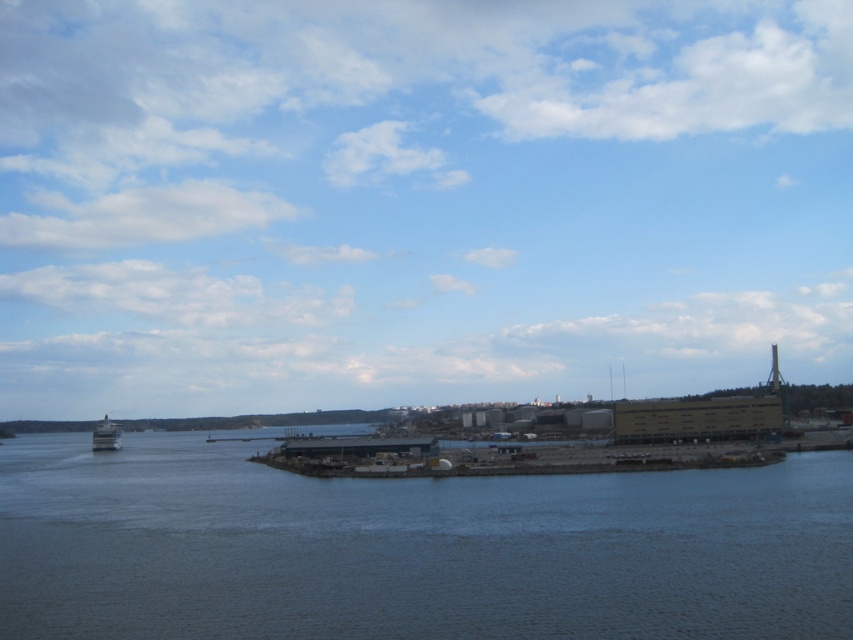
In the scene shown: You are standing on the shore looking at the dark blue water at lower center and the metallic gray boat at left. Which object is nearer to you?

The dark blue water at lower center is closer to the viewer than the metallic gray boat at left.

You are standing on the shore looking at the dark blue water at lower center and the metallic gray boat at left. Which object is higher in the image?

The dark blue water at lower center is above the metallic gray boat at left, so it is higher in the image.

You are standing at the waterfront and want to know how far the point at coordinates (297, 506) is from you. Can you determine the distance?

The point at coordinates (297, 506) is 73.53 meters away from the viewer.